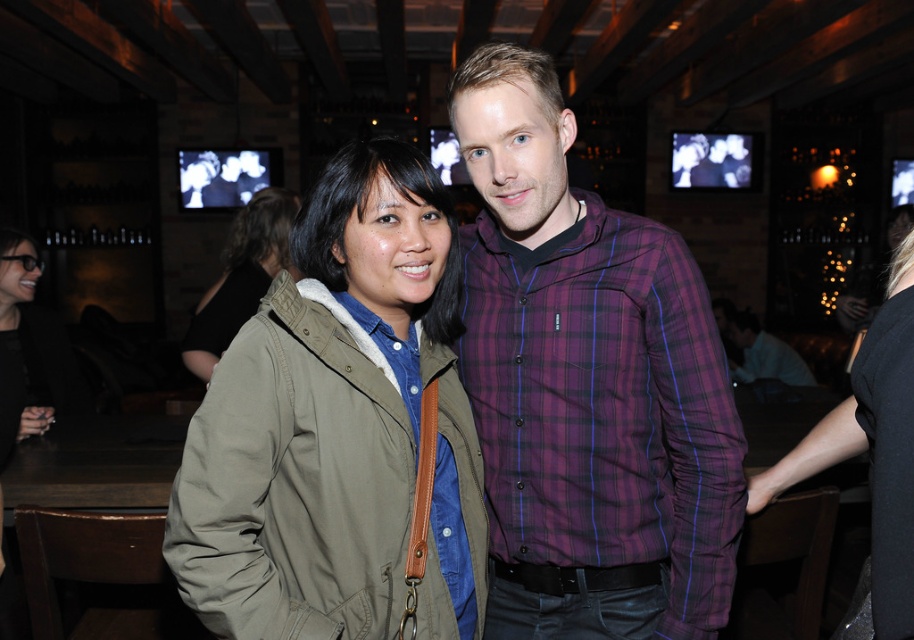
You are a photographer trying to capture a clear shot of both the khaki fabric jacket at center and the plaid cotton shirt at center. Since you want to ensure both are visible, which item should you focus on first to account for their sizes?

The khaki fabric jacket at center is taller than the plaid cotton shirt at center, so you should focus on the khaki fabric jacket at center first to ensure its full height is captured before adjusting for the smaller plaid cotton shirt at center.

You are a photographer at the event and want to ensure both the plaid fabric shirt at center and the black fabric dress at lower right are visible in your photo. Considering their sizes, which one might you need to position closer to the camera to ensure visibility?

The plaid fabric shirt at center is larger than the black fabric dress at lower right, so you should position the black fabric dress at lower right closer to the camera to ensure both are visible.

In the scene described, there are two clothing items visible. The first is a matte black jacket at lower left, and the second is a plaid cotton shirt at center. From the perspective of someone facing the scene, which clothing item is positioned to the left of the other?

The matte black jacket at lower left is to the left of the plaid cotton shirt at center.